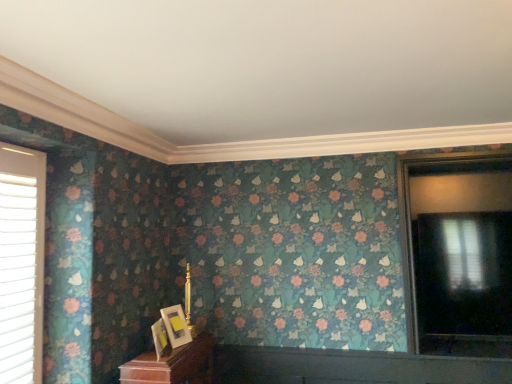
Question: From a real-world perspective, is matte gold picture frame at lower center, the 2th picture frame viewed from the back, located higher than matte gold picture frame at lower center, which is the 1th picture frame from back to front?

Choices:
 (A) yes
 (B) no

Answer: (B)

Question: Can you confirm if matte gold picture frame at lower center, which is the 1th picture frame in front-to-back order, is wider than matte gold picture frame at lower center, which is the 1th picture frame from back to front?

Choices:
 (A) no
 (B) yes

Answer: (A)

Question: Does matte gold picture frame at lower center, the 2th picture frame viewed from the back, have a greater height compared to matte gold picture frame at lower center, the 2th picture frame in the front-to-back sequence?

Choices:
 (A) no
 (B) yes

Answer: (A)

Question: Does matte gold picture frame at lower center, the 2th picture frame viewed from the back, lie in front of matte gold picture frame at lower center, which is the 1th picture frame from back to front?

Choices:
 (A) no
 (B) yes

Answer: (B)

Question: Is matte gold picture frame at lower center, the 2th picture frame viewed from the back, positioned with its back to matte gold picture frame at lower center, which is the 1th picture frame from back to front?

Choices:
 (A) yes
 (B) no

Answer: (B)

Question: Does matte gold picture frame at lower center, the 2th picture frame viewed from the back, contain matte gold picture frame at lower center, which is the 1th picture frame from back to front?

Choices:
 (A) no
 (B) yes

Answer: (A)

Question: Is matte gold picture frame at lower center, which is the 1th picture frame from back to front, facing away from matte gold picture frame at lower center, which is the 1th picture frame in front-to-back order?

Choices:
 (A) yes
 (B) no

Answer: (B)

Question: Can we say matte gold picture frame at lower center, which is the 1th picture frame from back to front, lies outside matte gold picture frame at lower center, the 2th picture frame viewed from the back?

Choices:
 (A) yes
 (B) no

Answer: (A)

Question: Can you confirm if matte gold picture frame at lower center, which is the 1th picture frame from back to front, is thinner than matte gold picture frame at lower center, the 2th picture frame viewed from the back?

Choices:
 (A) no
 (B) yes

Answer: (A)

Question: From the image's perspective, does matte gold picture frame at lower center, the 2th picture frame in the front-to-back sequence, appear lower than matte gold picture frame at lower center, the 2th picture frame viewed from the back?

Choices:
 (A) yes
 (B) no

Answer: (B)

Question: From the image's perspective, would you say matte gold picture frame at lower center, which is the 1th picture frame from back to front, is positioned over matte gold picture frame at lower center, which is the 1th picture frame in front-to-back order?

Choices:
 (A) no
 (B) yes

Answer: (B)

Question: Is matte gold picture frame at lower center, which is the 1th picture frame from back to front, at the right side of matte gold picture frame at lower center, which is the 1th picture frame in front-to-back order?

Choices:
 (A) no
 (B) yes

Answer: (B)

Question: Is matte black window at right, which ranks as the first window in right-to-left order, turned away from matte gold picture frame at lower center, which is the 1th picture frame in front-to-back order?

Choices:
 (A) yes
 (B) no

Answer: (B)